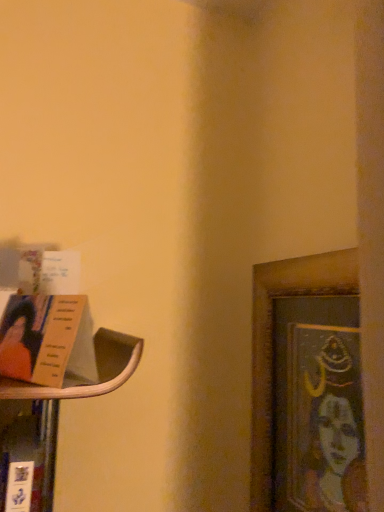
Image resolution: width=384 pixels, height=512 pixels. What do you see at coordinates (47, 340) in the screenshot? I see `matte paper book at left` at bounding box center [47, 340].

What is the approximate width of matte paper book at left?

matte paper book at left is 1.54 inches in width.

Where is `matte paper book at left`? matte paper book at left is located at coordinates (47, 340).

Measure the distance between matte paper book at left and camera.

matte paper book at left and camera are 18.08 inches apart.

Describe the element at coordinates (306, 384) in the screenshot. Image resolution: width=384 pixels, height=512 pixels. I see `wooden framed portrait at right` at that location.

What is the approximate height of wooden framed portrait at right?

wooden framed portrait at right is 47.33 centimeters tall.

Locate an element on the screen. The width and height of the screenshot is (384, 512). wooden framed portrait at right is located at coordinates (306, 384).

Image resolution: width=384 pixels, height=512 pixels. Identify the location of matte paper book at left. (47, 340).

Consider the image. Between matte paper book at left and wooden framed portrait at right, which one appears on the left side from the viewer's perspective?

matte paper book at left is more to the left.

Is the depth of matte paper book at left greater than that of wooden framed portrait at right?

No, matte paper book at left is closer to the camera.

Considering the positions of points (62, 333) and (272, 411), is point (62, 333) closer to camera compared to point (272, 411)?

Yes, point (62, 333) is in front of point (272, 411).

From the image's perspective, would you say matte paper book at left is positioned over wooden framed portrait at right?

Correct, matte paper book at left appears higher than wooden framed portrait at right in the image.

From a real-world perspective, which object rests below the other?

wooden framed portrait at right.

Based on the photo, does matte paper book at left have a greater width compared to wooden framed portrait at right?

No.

In terms of height, does matte paper book at left look taller or shorter compared to wooden framed portrait at right?

Considering their sizes, matte paper book at left has less height than wooden framed portrait at right.

Who is bigger, matte paper book at left or wooden framed portrait at right?

wooden framed portrait at right.

Is wooden framed portrait at right completely or partially inside matte paper book at left?

That's incorrect, wooden framed portrait at right is not inside matte paper book at left.

Is matte paper book at left far away from wooden framed portrait at right?

No, matte paper book at left is not far from wooden framed portrait at right.

Is matte paper book at left turned away from wooden framed portrait at right?

Yes.

You are a GUI agent. You are given a task and a screenshot of the screen. Output one action in this format:
    pyautogui.click(x=<x>, y=<y>)
    Task: Click on the book located above the wooden framed portrait at right (from a real-world perspective)
    This screenshot has height=512, width=384.
    Given the screenshot: What is the action you would take?
    pyautogui.click(x=47, y=340)

Is wooden framed portrait at right to the right of matte paper book at left from the viewer's perspective?

Correct, you'll find wooden framed portrait at right to the right of matte paper book at left.

Considering their positions, is wooden framed portrait at right located in front of or behind matte paper book at left?

wooden framed portrait at right is positioned farther from the viewer than matte paper book at left.

Is point (306, 404) farther from viewer compared to point (27, 359)?

Yes, point (306, 404) is farther from viewer.

From the image's perspective, which is below, wooden framed portrait at right or matte paper book at left?

From the image's view, wooden framed portrait at right is below.

From a real-world perspective, which is physically above, wooden framed portrait at right or matte paper book at left?

matte paper book at left.

Looking at their sizes, would you say wooden framed portrait at right is wider or thinner than matte paper book at left?

wooden framed portrait at right is wider than matte paper book at left.

Consider the image. Can you confirm if wooden framed portrait at right is taller than matte paper book at left?

Correct, wooden framed portrait at right is much taller as matte paper book at left.

Is wooden framed portrait at right bigger or smaller than matte paper book at left?

Considering their sizes, wooden framed portrait at right takes up more space than matte paper book at left.

Which is correct: wooden framed portrait at right is inside matte paper book at left, or outside of it?

wooden framed portrait at right is not inside matte paper book at left, it's outside.

Is wooden framed portrait at right far away from matte paper book at left?

wooden framed portrait at right is near matte paper book at left, not far away.

Is wooden framed portrait at right oriented away from matte paper book at left?

No, matte paper book at left is not at the back of wooden framed portrait at right.

Find the location of `picture frame located underneath the matte paper book at left (from a real-world perspective)`. picture frame located underneath the matte paper book at left (from a real-world perspective) is located at coordinates click(x=306, y=384).

This screenshot has width=384, height=512. I want to click on book on the left of the wooden framed portrait at right, so click(47, 340).

You are a GUI agent. You are given a task and a screenshot of the screen. Output one action in this format:
    pyautogui.click(x=<x>, y=<y>)
    Task: Click on the picture frame located below the matte paper book at left (from the image's perspective)
    
    Given the screenshot: What is the action you would take?
    pyautogui.click(x=306, y=384)